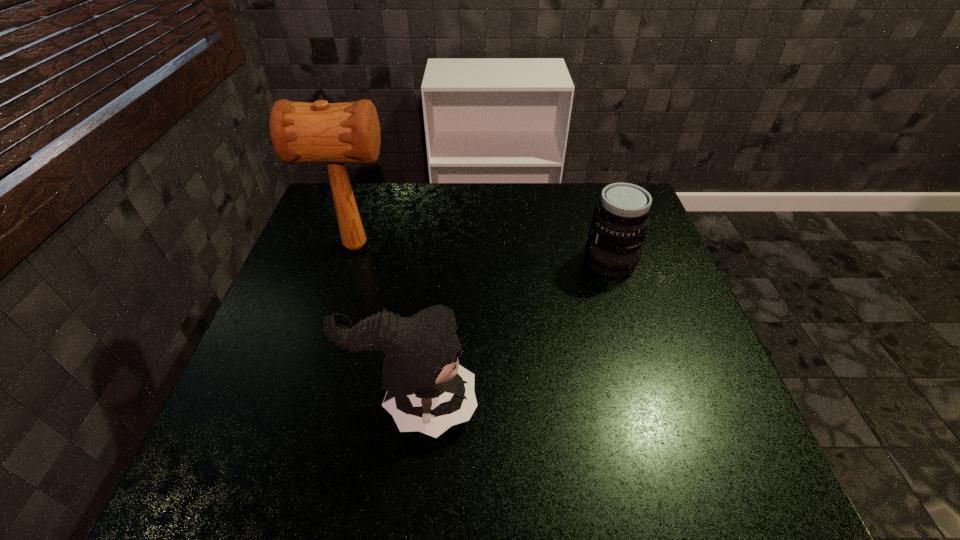
In the image, there is a desktop. Identify the location of blank space at the far edge. (488, 210).

In order to click on vacant space at the near edge of the desktop in this screenshot , I will do `click(552, 460)`.

The image size is (960, 540). I want to click on vacant area at the left edge, so click(x=322, y=351).

In order to click on vacant space at the right edge of the desktop in this screenshot , I will do `click(650, 340)`.

Locate an element on the screen. The width and height of the screenshot is (960, 540). free region at the near right corner of the desktop is located at coordinates (740, 483).

Where is `unoccupied position between the shortest object and the second tallest object`? unoccupied position between the shortest object and the second tallest object is located at coordinates (513, 333).

In order to click on vacant area that lies between the tallest object and the rightmost object in this screenshot , I will do `click(483, 254)`.

Image resolution: width=960 pixels, height=540 pixels. Identify the location of free space between the rightmost object and the second tallest object. (513, 333).

Locate an element on the screen. Image resolution: width=960 pixels, height=540 pixels. free space that is in between the nearest object and the telephoto lens is located at coordinates (513, 333).

Locate an element on the screen. free space that is in between the tallest object and the rightmost object is located at coordinates (483, 254).